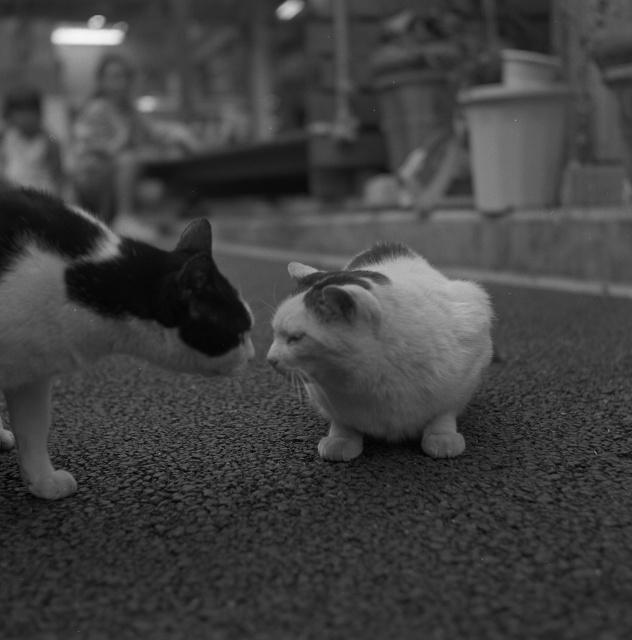
From the picture: You are taking a walk in a park and see two cats, the black and white fur cat at left and the fluffy white cat at center. Which cat is nearer to you?

The black and white fur cat at left is closer to the viewer than the fluffy white cat at center, so the black and white fur cat at left is nearer to you.

In the scene shown: You are a veterinarian examining two cats in an outdoor setting. The cats are the black and white fur cat at left and the fluffy white cat at center. Which cat has a thinner body structure?

The black and white fur cat at left has a thinner body structure than the fluffy white cat at center.

You are a photographer who wants to capture a closeup of the fluffy white cat at center without including the black and white fur cat at left in the frame. Based on their positions, is this possible?

Yes, since the black and white fur cat at left is to the left of the fluffy white cat at center, you can position the camera to frame the fluffy white cat at center while excluding the black and white fur cat at left by adjusting the angle or cropping the left side of the image.